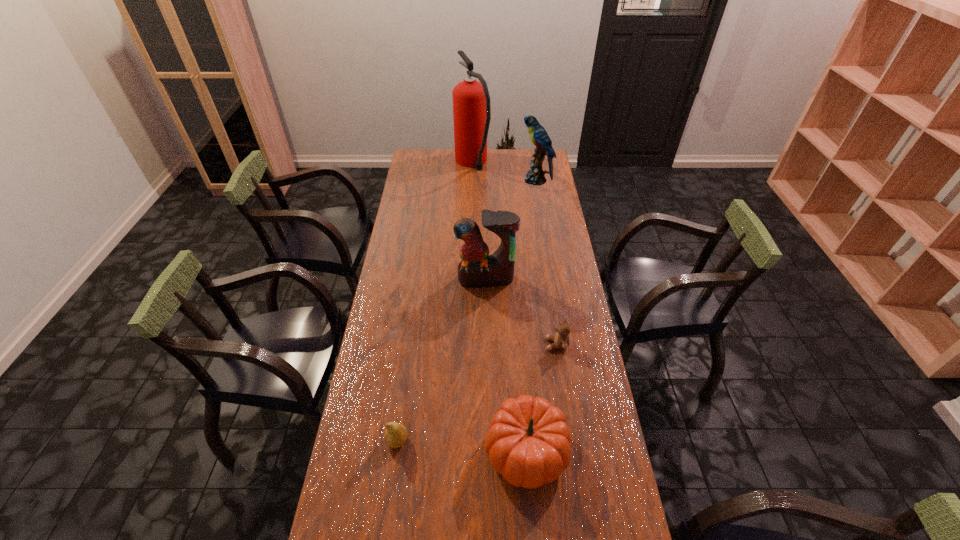
The height and width of the screenshot is (540, 960). I want to click on vacant region between the pear and the left parrot, so click(x=442, y=360).

Locate an element on the screen. object that is the fifth closest to the farther parrot is located at coordinates (395, 436).

In order to click on object that is the fifth closest to the pear in this screenshot , I will do click(471, 101).

Locate an element on the screen. The height and width of the screenshot is (540, 960). free spot that satisfies the following two spatial constraints: 1. on the front side of the pear; 2. on the right side of the third shortest object is located at coordinates (396, 451).

This screenshot has height=540, width=960. I want to click on vacant space that satisfies the following two spatial constraints: 1. on the face of the farther parrot; 2. on the front side of the fourth tallest object, so click(580, 451).

You are a GUI agent. You are given a task and a screenshot of the screen. Output one action in this format:
    pyautogui.click(x=<x>, y=<y>)
    Task: Click on the vacant area in the image that satisfies the following two spatial constraints: 1. on the face of the right parrot; 2. on the front side of the pumpkin
    The width and height of the screenshot is (960, 540).
    Given the screenshot: What is the action you would take?
    pyautogui.click(x=580, y=451)

At what (x,y) coordinates should I click in order to perform the action: click on free region that satisfies the following two spatial constraints: 1. on the face of the right parrot; 2. at the face of the third farthest object. Please return your answer as a coordinate pair (x, y). This screenshot has width=960, height=540. Looking at the image, I should click on click(x=552, y=279).